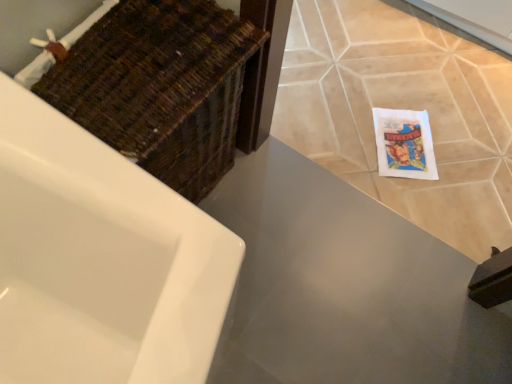
Question: Is matte gray countertop at center aimed at beige ceramic tile at lower right?

Choices:
 (A) no
 (B) yes

Answer: (B)

Question: From a real-world perspective, is matte gray countertop at center positioned under beige ceramic tile at lower right based on gravity?

Choices:
 (A) yes
 (B) no

Answer: (A)

Question: Would you say matte gray countertop at center is a long distance from beige ceramic tile at lower right?

Choices:
 (A) no
 (B) yes

Answer: (A)

Question: Is the position of matte gray countertop at center more distant than that of beige ceramic tile at lower right?

Choices:
 (A) no
 (B) yes

Answer: (A)

Question: Could beige ceramic tile at lower right be considered to be inside matte gray countertop at center?

Choices:
 (A) yes
 (B) no

Answer: (B)

Question: In terms of height, does woven brown basket at upper left look taller or shorter compared to beige ceramic tile at lower right?

Choices:
 (A) tall
 (B) short

Answer: (A)

Question: Relative to beige ceramic tile at lower right, is woven brown basket at upper left in front or behind?

Choices:
 (A) behind
 (B) front

Answer: (B)

Question: Visually, is woven brown basket at upper left positioned to the left or to the right of beige ceramic tile at lower right?

Choices:
 (A) right
 (B) left

Answer: (B)

Question: Considering the positions of woven brown basket at upper left and beige ceramic tile at lower right in the image, is woven brown basket at upper left bigger or smaller than beige ceramic tile at lower right?

Choices:
 (A) big
 (B) small

Answer: (A)

Question: Considering the positions of beige ceramic tile at lower right and woven brown basket at upper left in the image, is beige ceramic tile at lower right bigger or smaller than woven brown basket at upper left?

Choices:
 (A) small
 (B) big

Answer: (A)

Question: Considering the positions of beige ceramic tile at lower right and woven brown basket at upper left in the image, is beige ceramic tile at lower right taller or shorter than woven brown basket at upper left?

Choices:
 (A) short
 (B) tall

Answer: (A)

Question: Is beige ceramic tile at lower right in front of or behind woven brown basket at upper left in the image?

Choices:
 (A) behind
 (B) front

Answer: (A)

Question: Is beige ceramic tile at lower right wider or thinner than woven brown basket at upper left?

Choices:
 (A) thin
 (B) wide

Answer: (B)

Question: From the image's perspective, relative to matte gray countertop at center, is woven brown basket at upper left above or below?

Choices:
 (A) above
 (B) below

Answer: (A)

Question: Is point (177, 28) closer or farther from the camera than point (479, 312)?

Choices:
 (A) farther
 (B) closer

Answer: (B)